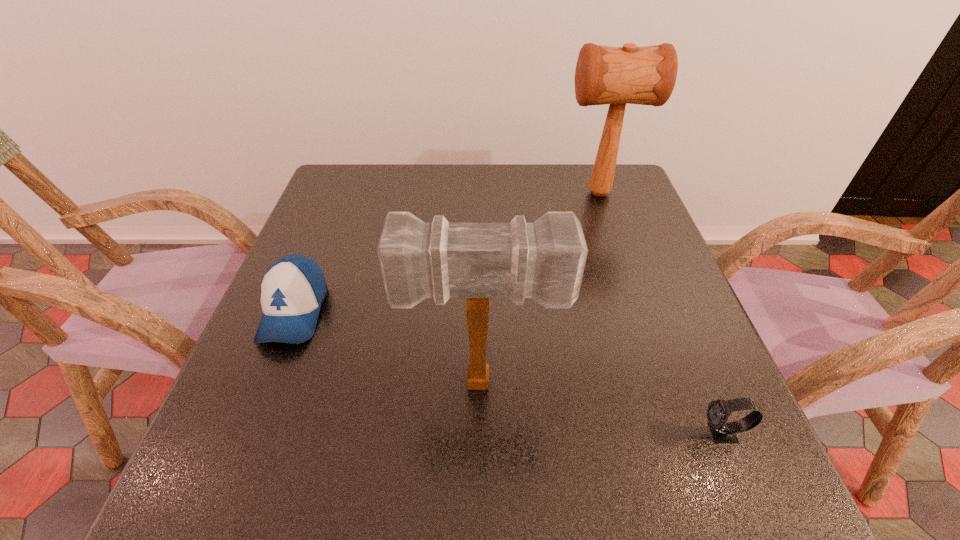
Locate an element on the screen. Image resolution: width=960 pixels, height=540 pixels. vacant space at the far edge is located at coordinates (464, 171).

In order to click on blank area at the left edge in this screenshot , I will do `click(342, 219)`.

This screenshot has height=540, width=960. In the image, there is a desktop. What are the coordinates of `vacant space at the right edge` in the screenshot? It's located at (609, 215).

Identify the location of free location at the far left corner. (344, 180).

Where is `free space at the far right corner of the desktop`? The image size is (960, 540). free space at the far right corner of the desktop is located at coordinates (588, 172).

This screenshot has height=540, width=960. I want to click on vacant area that lies between the nearest object and the baseball cap, so click(509, 373).

Where is `free area in between the nearer mallet and the second farthest object`? free area in between the nearer mallet and the second farthest object is located at coordinates tap(388, 347).

The height and width of the screenshot is (540, 960). In order to click on free space that is in between the farthest object and the nearest object in this screenshot , I will do `click(660, 314)`.

The height and width of the screenshot is (540, 960). What are the coordinates of `empty space that is in between the baseball cap and the nearer mallet` in the screenshot? It's located at (388, 347).

Image resolution: width=960 pixels, height=540 pixels. Find the location of `vacant area between the third farthest object and the third nearest object`. vacant area between the third farthest object and the third nearest object is located at coordinates pos(388,347).